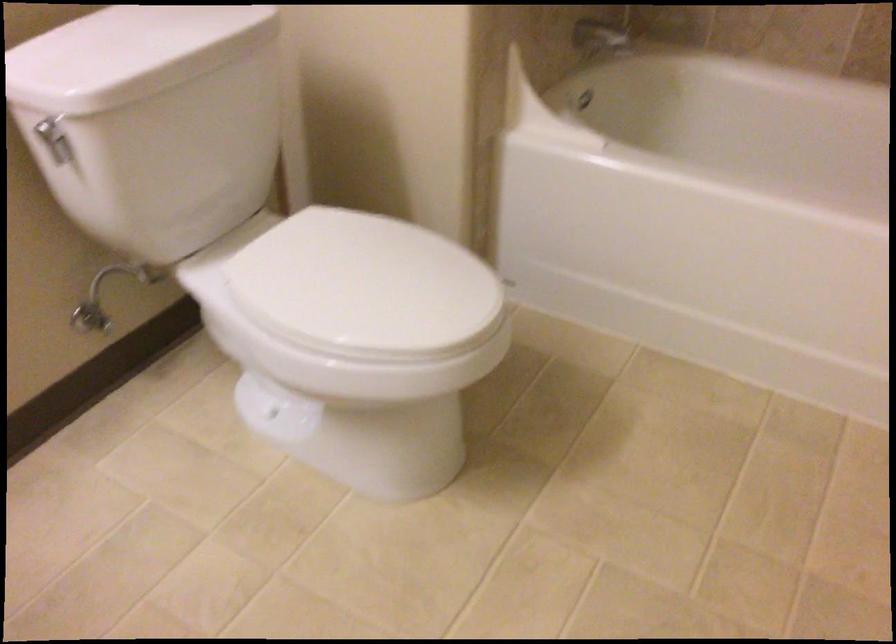
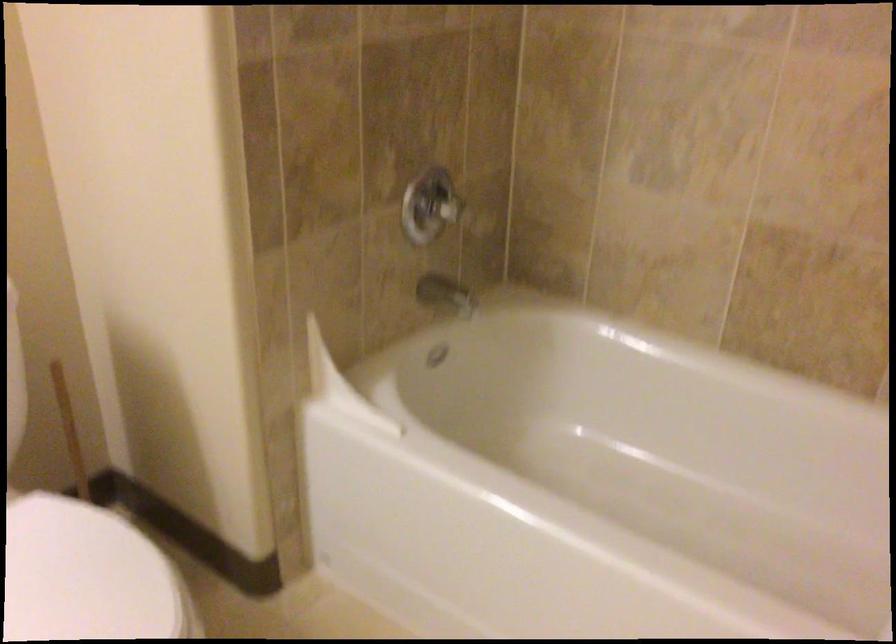
Find the pixel in the second image that matches (389,252) in the first image.

(88, 576)